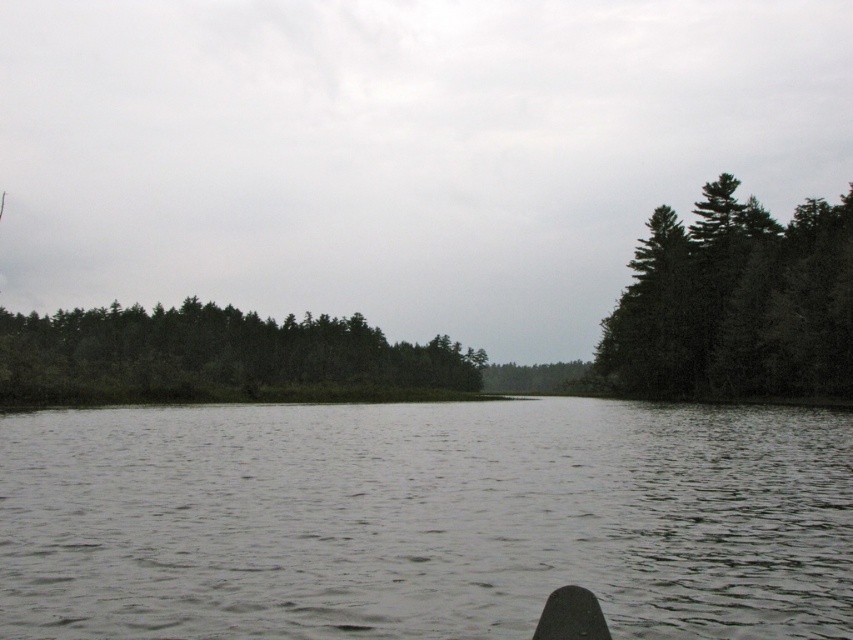
Between gray matte water at center and dark green textured trees at right, which one has more height?

dark green textured trees at right is taller.

Between gray matte water at center and dark green textured trees at right, which one has less height?

gray matte water at center

Locate an element on the screen. gray matte water at center is located at coordinates (424, 520).

I want to click on gray matte water at center, so click(x=424, y=520).

Between dark green textured trees at right and green matte trees at center, which one has more height?

dark green textured trees at right is taller.

Does dark green textured trees at right appear over green matte trees at center?

Indeed, dark green textured trees at right is positioned over green matte trees at center.

Between point (788, 333) and point (91, 356), which one is positioned behind?

The point (91, 356) is more distant.

Locate an element on the screen. dark green textured trees at right is located at coordinates (735, 301).

Consider the image. Does gray matte water at center have a lesser height compared to green matte trees at center?

Indeed, gray matte water at center has a lesser height compared to green matte trees at center.

Is gray matte water at center taller than green matte trees at center?

No.

The width and height of the screenshot is (853, 640). Identify the location of gray matte water at center. click(424, 520).